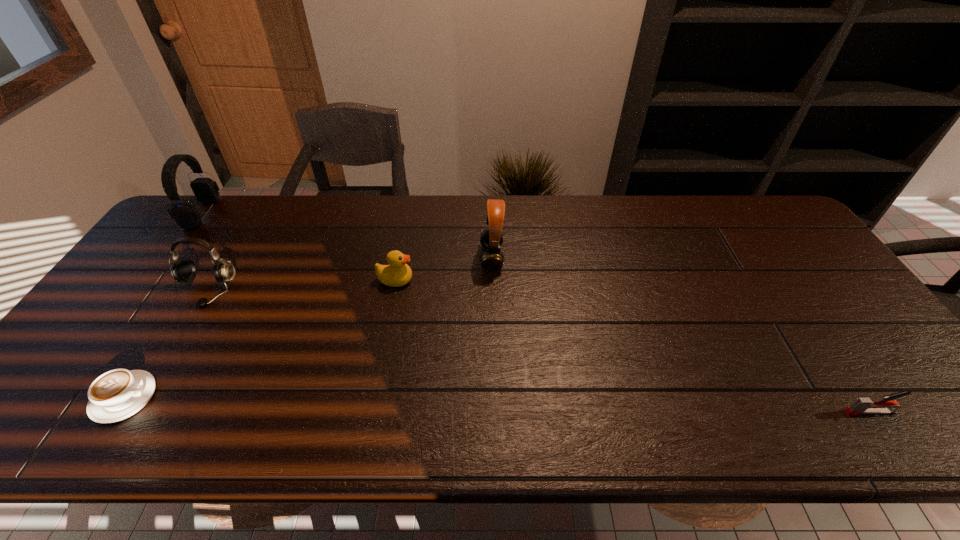
Locate an element on the screen. This screenshot has height=540, width=960. the leftmost object is located at coordinates (186, 215).

The width and height of the screenshot is (960, 540). In order to click on the leftmost headset in this screenshot , I will do `click(186, 215)`.

Identify the location of the rightmost headset. The image size is (960, 540). 492,259.

This screenshot has width=960, height=540. Find the location of `the second headset from right to left`. the second headset from right to left is located at coordinates (183, 270).

Image resolution: width=960 pixels, height=540 pixels. I want to click on the shortest headset, so click(x=183, y=270).

In order to click on the third object from right to left in this screenshot , I will do `click(397, 273)`.

At what (x,y) coordinates should I click in order to perform the action: click on duck. Please return your answer as a coordinate pair (x, y). This screenshot has height=540, width=960. Looking at the image, I should click on (397, 273).

Identify the location of the rightmost object. Image resolution: width=960 pixels, height=540 pixels. (863, 405).

The height and width of the screenshot is (540, 960). What are the coordinates of `stapler` in the screenshot? It's located at (863, 405).

In order to click on cappuccino in this screenshot , I will do `click(116, 395)`.